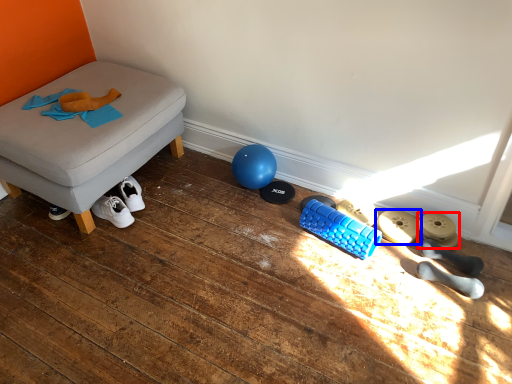
Question: Which point is closer to the camera, footwear (highlighted by a red box) or footwear (highlighted by a blue box)?

Choices:
 (A) footwear
 (B) footwear

Answer: (A)